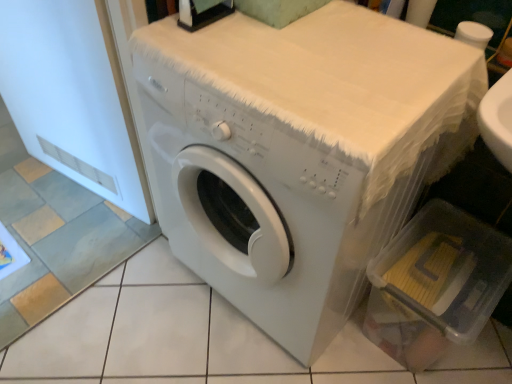
Question: Does clear plastic container at lower right appear on the right side of white matte screen door at left?

Choices:
 (A) no
 (B) yes

Answer: (B)

Question: From a real-world perspective, is clear plastic container at lower right located higher than white matte screen door at left?

Choices:
 (A) yes
 (B) no

Answer: (B)

Question: Can we say clear plastic container at lower right lies outside white matte screen door at left?

Choices:
 (A) yes
 (B) no

Answer: (A)

Question: From the image's perspective, is clear plastic container at lower right beneath white matte screen door at left?

Choices:
 (A) no
 (B) yes

Answer: (B)

Question: Considering the relative sizes of clear plastic container at lower right and white matte screen door at left in the image provided, is clear plastic container at lower right bigger than white matte screen door at left?

Choices:
 (A) no
 (B) yes

Answer: (A)

Question: Considering the relative sizes of clear plastic container at lower right and white matte screen door at left in the image provided, is clear plastic container at lower right smaller than white matte screen door at left?

Choices:
 (A) yes
 (B) no

Answer: (A)

Question: Could you tell me if white matte screen door at left is facing white matte washing machine at center?

Choices:
 (A) yes
 (B) no

Answer: (B)

Question: Considering the relative sizes of white matte screen door at left and white matte washing machine at center in the image provided, is white matte screen door at left bigger than white matte washing machine at center?

Choices:
 (A) no
 (B) yes

Answer: (A)

Question: Does white matte screen door at left appear on the right side of white matte washing machine at center?

Choices:
 (A) yes
 (B) no

Answer: (B)

Question: Is white matte screen door at left smaller than white matte washing machine at center?

Choices:
 (A) no
 (B) yes

Answer: (B)

Question: Are white matte screen door at left and white matte washing machine at center making contact?

Choices:
 (A) yes
 (B) no

Answer: (B)

Question: Does white matte screen door at left have a lesser width compared to white matte washing machine at center?

Choices:
 (A) yes
 (B) no

Answer: (A)

Question: From the image's perspective, is clear plastic container at lower right on top of white matte washing machine at center?

Choices:
 (A) no
 (B) yes

Answer: (A)